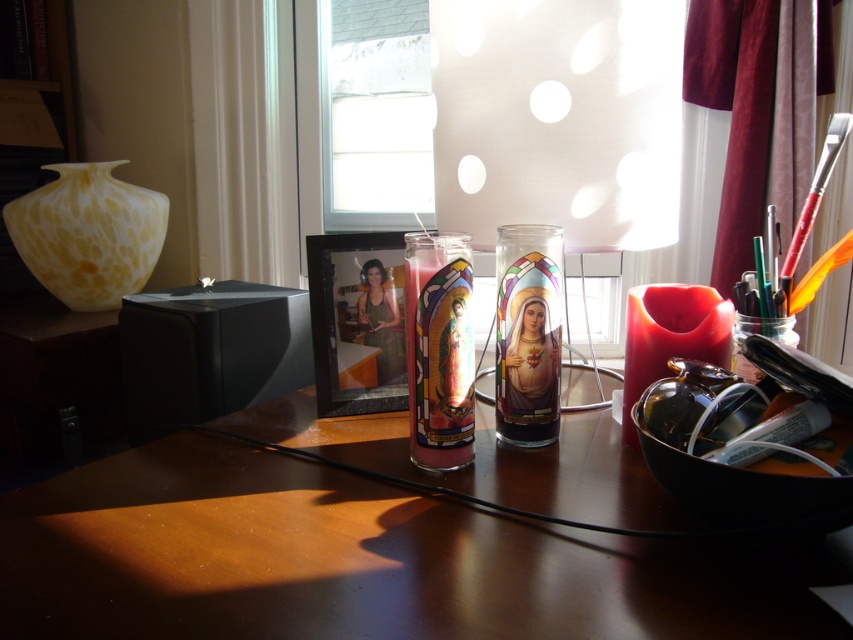
Question: Among these objects, which one is nearest to the camera?

Choices:
 (A) matte yellow glass vase at left
 (B) stained glass candle at center

Answer: (B)

Question: Does brown wooden table at center have a larger size compared to transparent glass window at upper center?

Choices:
 (A) no
 (B) yes

Answer: (B)

Question: Can you confirm if stained glass candle at center is positioned above translucent plastic jar at right?

Choices:
 (A) yes
 (B) no

Answer: (B)

Question: Which point is closer to the camera taking this photo?

Choices:
 (A) (738, 333)
 (B) (402, 1)

Answer: (A)

Question: Based on their relative distances, which object is farther from the matte white lampshade at center?

Choices:
 (A) matte yellow glass vase at left
 (B) stained glass candle at center
 (C) transparent glass window at upper center
 (D) translucent plastic jar at right

Answer: (A)

Question: Is brown wooden table at center in front of matte white lampshade at center?

Choices:
 (A) no
 (B) yes

Answer: (B)